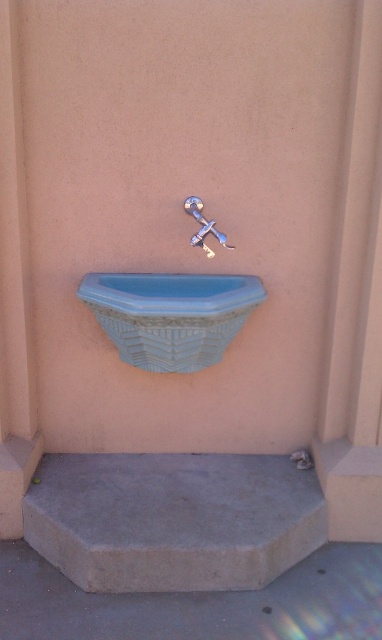
Question: Can you confirm if gray concrete step at lower center is positioned to the left of blue ceramic sink at center?

Choices:
 (A) yes
 (B) no

Answer: (B)

Question: Which object appears farthest from the camera in this image?

Choices:
 (A) satin nickel faucet at center
 (B) gray concrete step at lower center
 (C) blue ceramic sink at center

Answer: (A)

Question: Which point is closer to the camera?

Choices:
 (A) blue ceramic sink at center
 (B) satin nickel faucet at center

Answer: (A)

Question: Which point is farther from the camera taking this photo?

Choices:
 (A) (184, 198)
 (B) (205, 312)

Answer: (A)

Question: Is gray concrete step at lower center wider than satin nickel faucet at center?

Choices:
 (A) yes
 (B) no

Answer: (A)

Question: Where is blue ceramic sink at center located in relation to satin nickel faucet at center in the image?

Choices:
 (A) above
 (B) below

Answer: (B)